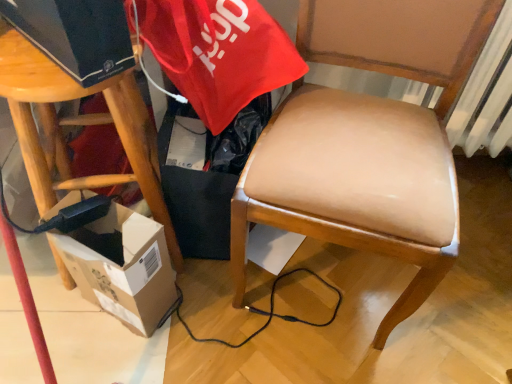
Question: From a real-world perspective, is wooden stool at left physically located above or below cardboard box at lower left?

Choices:
 (A) below
 (B) above

Answer: (B)

Question: Is wooden stool at left situated inside cardboard box at lower left or outside?

Choices:
 (A) outside
 (B) inside

Answer: (A)

Question: Which of these objects is positioned closest to the wooden stool at left?

Choices:
 (A) cardboard box at lower left
 (B) leather-like tan chair at center

Answer: (A)

Question: Estimate the real-world distances between objects in this image. Which object is closer to the wooden stool at left?

Choices:
 (A) leather-like tan chair at center
 (B) cardboard box at lower left

Answer: (B)